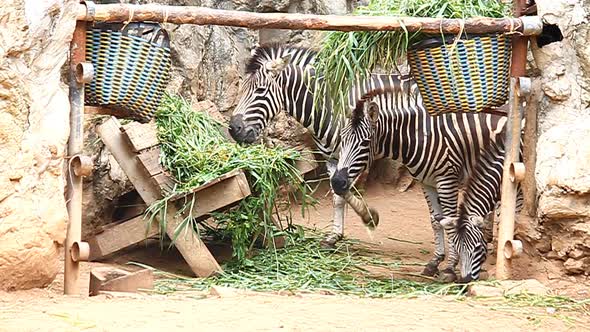
Identify the location of basket. (124, 68).